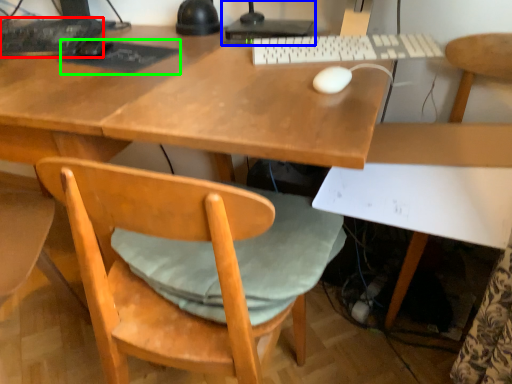
Question: Which object is positioned farthest from computer keyboard (highlighted by a red box)? Select from desktop computer (highlighted by a blue box) and mousepad (highlighted by a green box).

Choices:
 (A) desktop computer
 (B) mousepad

Answer: (A)